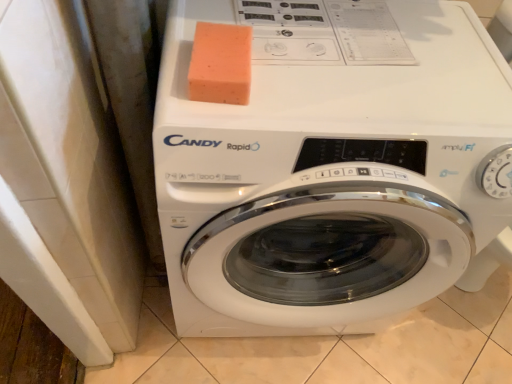
Find the location of a particular element. white glossy washing machine at center is located at coordinates (331, 165).

This screenshot has width=512, height=384. Describe the element at coordinates (331, 165) in the screenshot. I see `white glossy washing machine at center` at that location.

Describe the element at coordinates (220, 64) in the screenshot. I see `orange sponge at upper center` at that location.

Identify the location of orange sponge at upper center. The height and width of the screenshot is (384, 512). (220, 64).

Where is `white glossy washing machine at center`? white glossy washing machine at center is located at coordinates (331, 165).

Which is more to the right, orange sponge at upper center or white glossy washing machine at center?

Positioned to the right is white glossy washing machine at center.

Relative to white glossy washing machine at center, is orange sponge at upper center in front or behind?

In the image, orange sponge at upper center appears behind white glossy washing machine at center.

Which is nearer, (240, 61) or (356, 49)?

The point (240, 61) is closer.

From the image's perspective, which is above, orange sponge at upper center or white glossy washing machine at center?

orange sponge at upper center is shown above in the image.

Based on the photo, from a real-world perspective, between orange sponge at upper center and white glossy washing machine at center, who is vertically lower?

From a 3D spatial view, white glossy washing machine at center is below.

Is orange sponge at upper center thinner than white glossy washing machine at center?

Indeed, orange sponge at upper center has a lesser width compared to white glossy washing machine at center.

Does orange sponge at upper center have a greater height compared to white glossy washing machine at center?

In fact, orange sponge at upper center may be shorter than white glossy washing machine at center.

Which of these two, orange sponge at upper center or white glossy washing machine at center, is bigger?

white glossy washing machine at center is bigger.

Is orange sponge at upper center not within white glossy washing machine at center?

Actually, orange sponge at upper center is at least partially inside white glossy washing machine at center.

Would you consider orange sponge at upper center to be distant from white glossy washing machine at center?

orange sponge at upper center is near white glossy washing machine at center, not far away.

Could you tell me if orange sponge at upper center is facing white glossy washing machine at center?

No, orange sponge at upper center is not turned towards white glossy washing machine at center.

I want to click on washing machine that is below the orange sponge at upper center (from the image's perspective), so click(331, 165).

Considering the relative positions of white glossy washing machine at center and orange sponge at upper center in the image provided, is white glossy washing machine at center to the left of orange sponge at upper center from the viewer's perspective?

No.

In the image, is white glossy washing machine at center positioned in front of or behind orange sponge at upper center?

Clearly, white glossy washing machine at center is in front of orange sponge at upper center.

Does point (295, 319) appear closer or farther from the camera than point (193, 97)?

Point (295, 319).

From the image's perspective, is white glossy washing machine at center below orange sponge at upper center?

Correct, white glossy washing machine at center appears lower than orange sponge at upper center in the image.

Consider the image. From a real-world perspective, is white glossy washing machine at center positioned above or below orange sponge at upper center?

Clearly, from a real-world perspective, white glossy washing machine at center is below orange sponge at upper center.

Is white glossy washing machine at center wider than orange sponge at upper center?

Correct, the width of white glossy washing machine at center exceeds that of orange sponge at upper center.

Considering the sizes of objects white glossy washing machine at center and orange sponge at upper center in the image provided, who is shorter, white glossy washing machine at center or orange sponge at upper center?

With less height is orange sponge at upper center.

Is white glossy washing machine at center bigger or smaller than orange sponge at upper center?

Clearly, white glossy washing machine at center is larger in size than orange sponge at upper center.

Is white glossy washing machine at center positioned beyond the bounds of orange sponge at upper center?

Yes, white glossy washing machine at center is not within orange sponge at upper center.

Are white glossy washing machine at center and orange sponge at upper center located far from each other?

No, white glossy washing machine at center is not far away from orange sponge at upper center.

Is white glossy washing machine at center facing towards orange sponge at upper center?

No, white glossy washing machine at center is not facing towards orange sponge at upper center.

Looking at this image, can you tell me how much white glossy washing machine at center and orange sponge at upper center differ in facing direction?

They differ by 4.3 degrees in their facing directions.

Where is `washing machine that is below the orange sponge at upper center (from the image's perspective)`? washing machine that is below the orange sponge at upper center (from the image's perspective) is located at coordinates (331, 165).

What are the coordinates of `washing machine that appears in front of the orange sponge at upper center` in the screenshot? It's located at (331, 165).

Where is `washing machine that appears on the right of orange sponge at upper center`? The image size is (512, 384). washing machine that appears on the right of orange sponge at upper center is located at coordinates (331, 165).